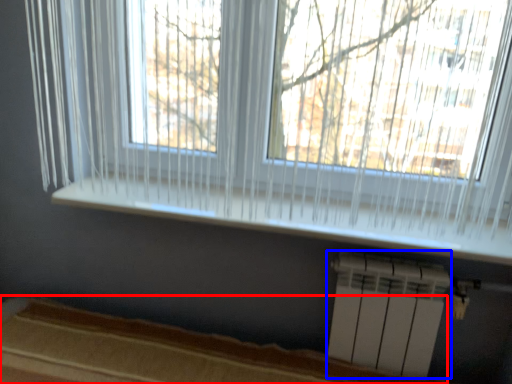
Question: Which object appears farthest to the camera in this image, bed frame (highlighted by a red box) or air conditioning (highlighted by a blue box)?

Choices:
 (A) bed frame
 (B) air conditioning

Answer: (B)